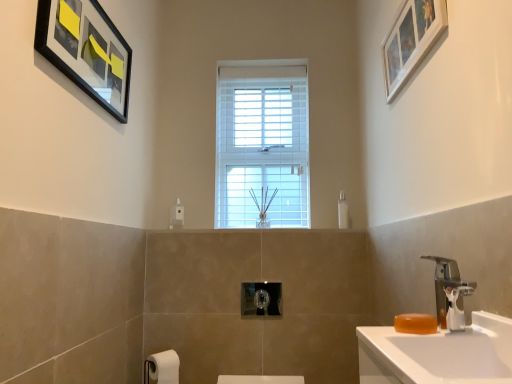
Question: From the image's perspective, does orange translucent soap at lower right appear higher than silver metallic faucet at right?

Choices:
 (A) no
 (B) yes

Answer: (A)

Question: Is orange translucent soap at lower right positioned in front of silver metallic faucet at right?

Choices:
 (A) no
 (B) yes

Answer: (B)

Question: Is orange translucent soap at lower right positioned beyond the bounds of silver metallic faucet at right?

Choices:
 (A) yes
 (B) no

Answer: (A)

Question: Is orange translucent soap at lower right at the right side of silver metallic faucet at right?

Choices:
 (A) yes
 (B) no

Answer: (B)

Question: Is the surface of orange translucent soap at lower right in direct contact with silver metallic faucet at right?

Choices:
 (A) no
 (B) yes

Answer: (A)

Question: Does orange translucent soap at lower right have a smaller size compared to silver metallic faucet at right?

Choices:
 (A) yes
 (B) no

Answer: (A)

Question: From a real-world perspective, does white wooden window at center stand above white matte toilet paper at lower left?

Choices:
 (A) no
 (B) yes

Answer: (B)

Question: Does white wooden window at center have a lesser height compared to white matte toilet paper at lower left?

Choices:
 (A) yes
 (B) no

Answer: (B)

Question: Is white wooden window at center taller than white matte toilet paper at lower left?

Choices:
 (A) yes
 (B) no

Answer: (A)

Question: From the image's perspective, is white wooden window at center over white matte toilet paper at lower left?

Choices:
 (A) yes
 (B) no

Answer: (A)

Question: Would you say white matte toilet paper at lower left is part of white wooden window at center's contents?

Choices:
 (A) no
 (B) yes

Answer: (A)

Question: Is white matte toilet paper at lower left at the back of white wooden window at center?

Choices:
 (A) yes
 (B) no

Answer: (B)

Question: Is black matte picture frame at upper left, marked as the 1th picture frame in a left-to-right arrangement, outside of polished chrome towel bar at center?

Choices:
 (A) yes
 (B) no

Answer: (A)